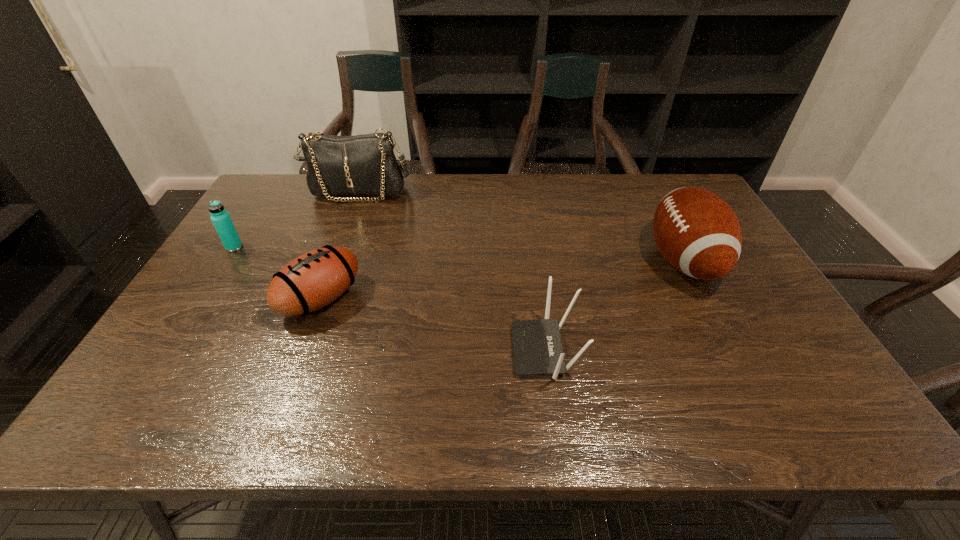
Locate an element on the screen. The width and height of the screenshot is (960, 540). vacant space situated 0.180m on the laces of the right football (American) is located at coordinates (585, 260).

Locate an element on the screen. The image size is (960, 540). free spot located 0.330m on the back of the leftmost object is located at coordinates (275, 185).

You are a GUI agent. You are given a task and a screenshot of the screen. Output one action in this format:
    pyautogui.click(x=<x>, y=<y>)
    Task: Click on the free location located on the left of the shorter football (American)
    The height and width of the screenshot is (540, 960).
    Given the screenshot: What is the action you would take?
    pyautogui.click(x=257, y=299)

Image resolution: width=960 pixels, height=540 pixels. I want to click on vacant space located 0.150m on the front-facing side of the router, so click(449, 350).

This screenshot has width=960, height=540. Find the location of `free space located on the front-facing side of the router`. free space located on the front-facing side of the router is located at coordinates (368, 350).

Find the location of a particular element. The width and height of the screenshot is (960, 540). blank area located 0.080m on the front-facing side of the router is located at coordinates 479,350.

Locate an element on the screen. The width and height of the screenshot is (960, 540). object that is at the far edge is located at coordinates (362, 165).

The image size is (960, 540). What are the coordinates of `handbag located in the left edge section of the desktop` in the screenshot? It's located at (362, 165).

Where is `water bottle at the left edge`? This screenshot has width=960, height=540. water bottle at the left edge is located at coordinates (220, 218).

You are a GUI agent. You are given a task and a screenshot of the screen. Output one action in this format:
    pyautogui.click(x=<x>, y=<y>)
    Task: Click on the object that is positioned at the right edge
    The height and width of the screenshot is (540, 960).
    Given the screenshot: What is the action you would take?
    pyautogui.click(x=697, y=232)